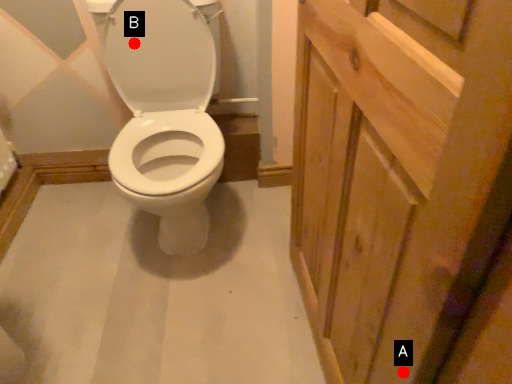
Question: Two points are circled on the image, labeled by A and B beside each circle. Which of the following is the farthest from the observer?

Choices:
 (A) A is further
 (B) B is further

Answer: (B)